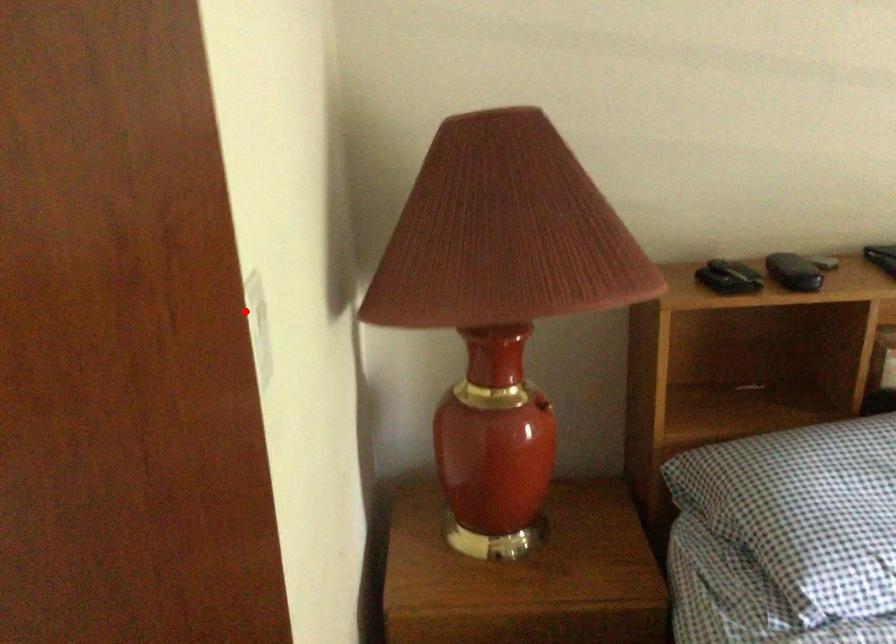
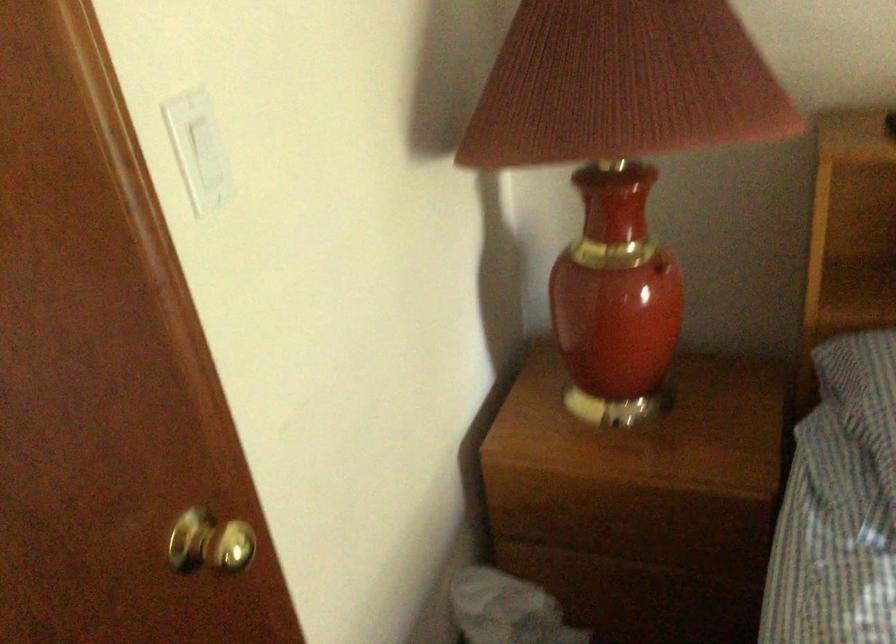
Question: I am providing you with two images of the same scene from different viewpoints. A red point is shown in image1. For the corresponding object point in image2, is it positioned nearer or farther from the camera?

Choices:
 (A) Nearer
 (B) Farther

Answer: (B)